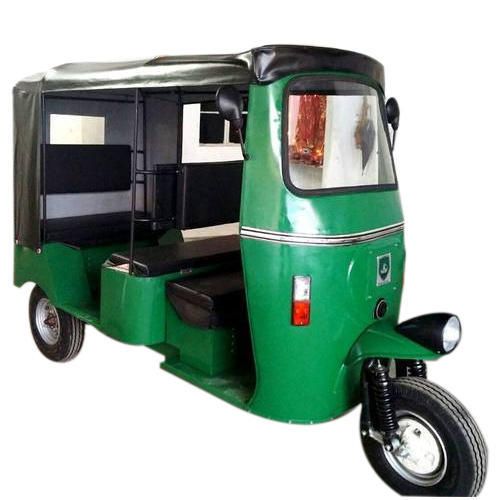
Image resolution: width=500 pixels, height=500 pixels. Identify the location of window. (338, 132).